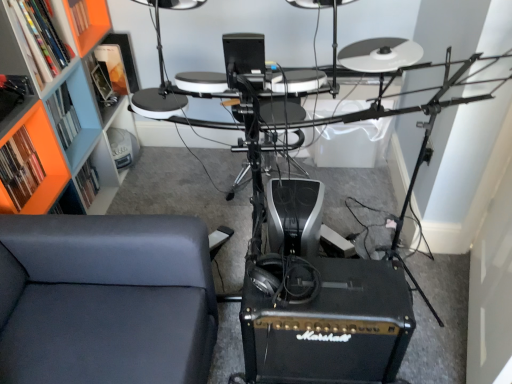
Question: Is orange matte bookshelf at upper left, the second shelf from the bottom, in front of or behind suede-like gray chair at lower left in the image?

Choices:
 (A) front
 (B) behind

Answer: (B)

Question: Is orange matte bookshelf at upper left, the second shelf from the bottom, taller or shorter than suede-like gray chair at lower left?

Choices:
 (A) short
 (B) tall

Answer: (A)

Question: Which of these objects is positioned farthest from the orange plastic shelf at left, acting as the second shelf starting from the top?

Choices:
 (A) orange matte bookshelf at upper left, the second shelf from the bottom
 (B) orange matte bookshelf at upper left, the first shelf ordered from the bottom
 (C) orange plastic shelf at upper left, which is counted as the 1th shelf, starting from the top
 (D) suede-like gray chair at lower left
 (E) black matte marshall amplifier at lower center

Answer: (E)

Question: Considering the real-world distances, which object is closest to the black matte marshall amplifier at lower center?

Choices:
 (A) orange matte bookshelf at upper left, the 4th shelf when ordered from top to bottom
 (B) orange matte bookshelf at upper left, the third shelf positioned from the top
 (C) orange plastic shelf at upper left, which is counted as the 1th shelf, starting from the top
 (D) orange plastic shelf at left, acting as the second shelf starting from the top
 (E) suede-like gray chair at lower left

Answer: (E)